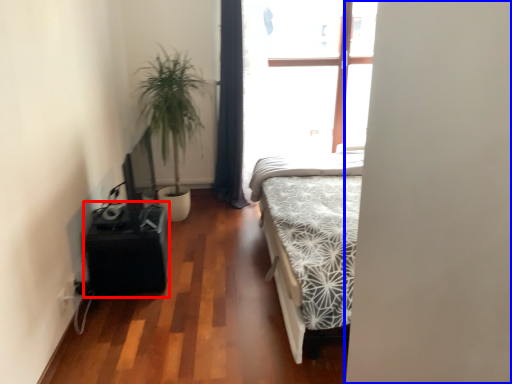
Question: Which object is closer to the camera taking this photo, table (highlighted by a red box) or screen door (highlighted by a blue box)?

Choices:
 (A) table
 (B) screen door

Answer: (B)